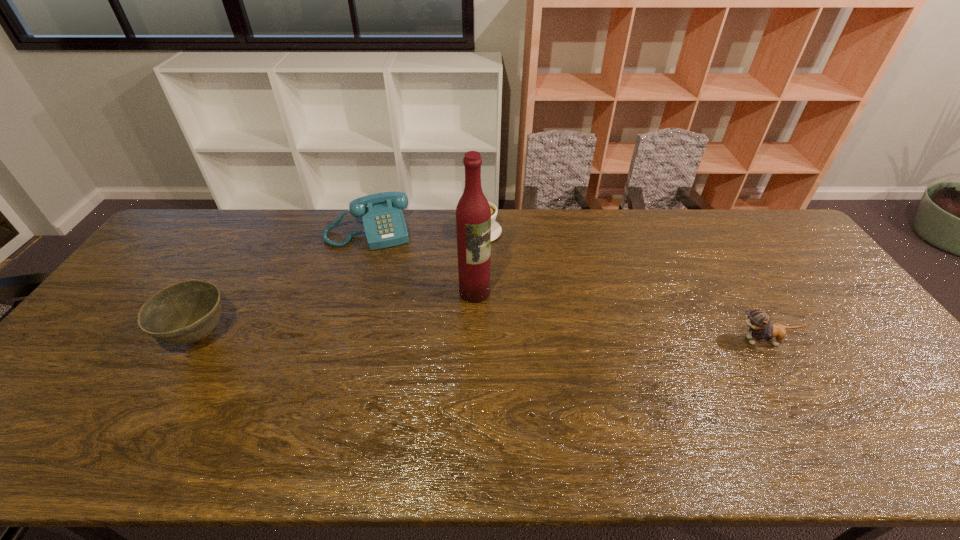
Image resolution: width=960 pixels, height=540 pixels. I want to click on vacant space located 0.120m to the right of the cappuccino's handle, so click(474, 270).

Find the location of a particular element. blank space located to the right of the cappuccino's handle is located at coordinates [470, 298].

The height and width of the screenshot is (540, 960). Find the location of `free spot located to the right of the cappuccino's handle`. free spot located to the right of the cappuccino's handle is located at coordinates [466, 329].

At what (x,y) coordinates should I click in order to perform the action: click on free space located 0.280m on the label of the liquor. Please return your answer as a coordinate pair (x, y). Looking at the image, I should click on (558, 359).

Where is `vacant space located 0.300m on the label of the liquor`? This screenshot has width=960, height=540. vacant space located 0.300m on the label of the liquor is located at coordinates (564, 364).

The height and width of the screenshot is (540, 960). Identify the location of free location located 0.210m on the label of the liquor. (538, 343).

In order to click on free space located 0.370m on the dial of the fourth object from right to left in this screenshot , I will do `click(398, 333)`.

Where is `free space located on the dial of the fourth object from right to left`? free space located on the dial of the fourth object from right to left is located at coordinates (388, 293).

You are a GUI agent. You are given a task and a screenshot of the screen. Output one action in this format:
    pyautogui.click(x=<x>, y=<y>)
    Task: Click on the free space located 0.400m on the dial of the fourth object from right to left
    The image size is (960, 540).
    Given the screenshot: What is the action you would take?
    pyautogui.click(x=400, y=341)

Where is `cappuccino that is positioned at the far edge`? The width and height of the screenshot is (960, 540). cappuccino that is positioned at the far edge is located at coordinates (496, 230).